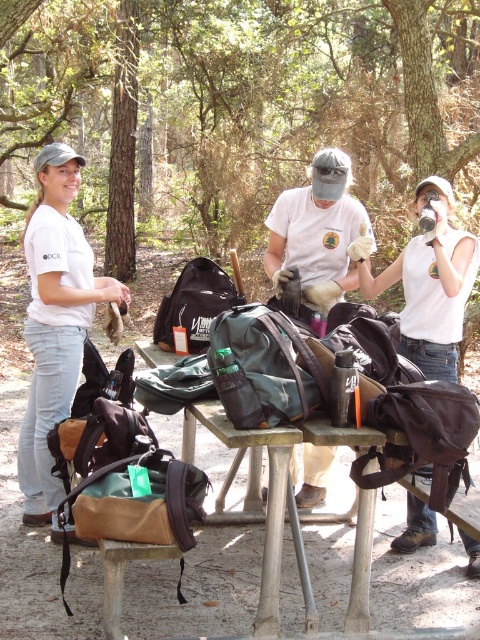
You are standing at the center of the forest scene. Looking towards the left, you see a point marked at coordinates (55,323). What object is located at that point?

The point at (55,323) marks the location of the matte white t shirt at left.

You are standing at the point with coordinates [232,460] in the forest scene. What object is exactly at your current location?

The metallic silver table at center is located at point [232,460].

You are standing at the forest trail and see the metallic silver table at center. If you want to reach it quickly, how many steps would you estimate to take?

The metallic silver table at center is 3.71 meters away from viewer. Assuming an average step length of 0.75 meters, you would need approximately 5 steps to reach it.